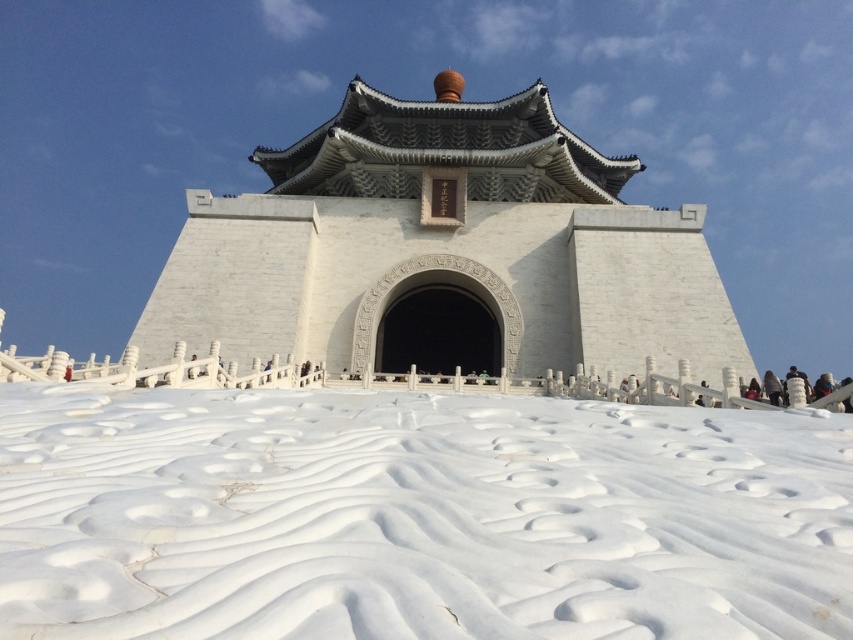
Does white textured snow at lower center appear under white stone temple at center?

Indeed, white textured snow at lower center is positioned under white stone temple at center.

Is point (677, 534) less distant than point (550, 122)?

Yes, it is.

Between point (389, 604) and point (427, 120), which one is positioned in front?

Positioned in front is point (389, 604).

Find the location of a particular element. This screenshot has width=853, height=640. white textured snow at lower center is located at coordinates (416, 516).